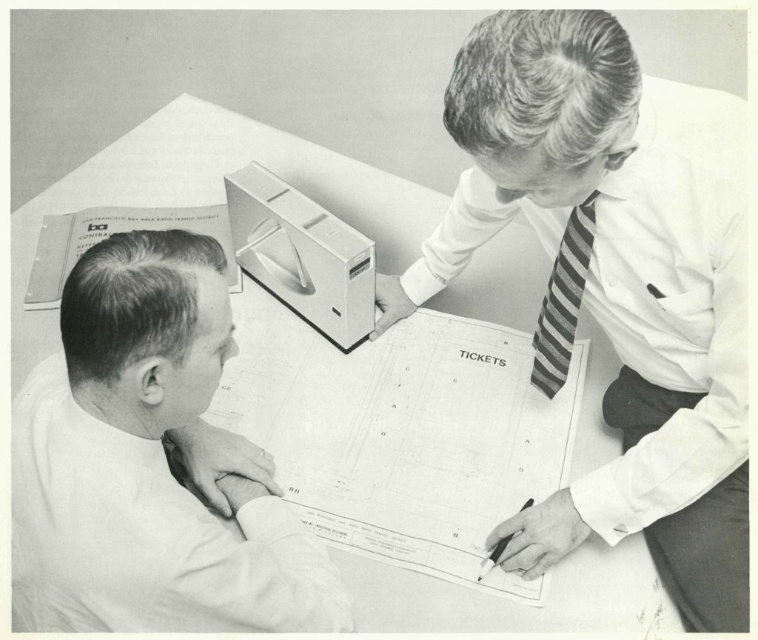
Question: Does white striped tie at upper center appear on the left side of smooth white shirt at lower left?

Choices:
 (A) yes
 (B) no

Answer: (B)

Question: Can you confirm if smooth white shirt at lower left is bigger than black plastic pen at lower center?

Choices:
 (A) yes
 (B) no

Answer: (A)

Question: Based on their relative distances, which object is farther from the white paper at upper center?

Choices:
 (A) white striped tie at upper center
 (B) smooth white shirt at lower left
 (C) striped fabric tie at upper right

Answer: (C)

Question: Which object appears farthest from the camera in this image?

Choices:
 (A) smooth white shirt at lower left
 (B) black plastic pen at lower center

Answer: (B)

Question: Is white striped tie at upper center smaller than smooth white shirt at lower left?

Choices:
 (A) no
 (B) yes

Answer: (A)

Question: Which object appears closest to the camera in this image?

Choices:
 (A) striped fabric tie at upper right
 (B) white striped tie at upper center

Answer: (B)